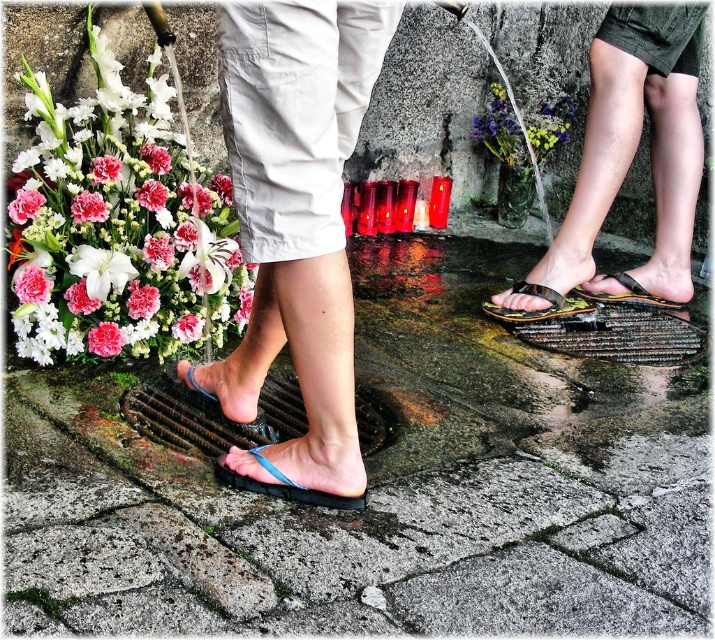
Question: Can you confirm if black rubber sandal at center is smaller than black rubber sandals at lower right?

Choices:
 (A) no
 (B) yes

Answer: (A)

Question: Does black rubber sandals at lower right appear under blue rubber flip-flop at lower left?

Choices:
 (A) yes
 (B) no

Answer: (B)

Question: Among these points, which one is farthest from the camera?

Choices:
 (A) (114, 342)
 (B) (498, 317)
 (C) (61, 433)

Answer: (B)

Question: Does matte floral bouquet at left appear over black rubber sandals at lower right?

Choices:
 (A) no
 (B) yes

Answer: (B)

Question: Which of the following is the farthest from the observer?

Choices:
 (A) (307, 493)
 (B) (423, 529)

Answer: (A)

Question: Among these objects, which one is farthest from the camera?

Choices:
 (A) pink matte carnation at left
 (B) blue rubber flip-flop at lower left
 (C) black rubber sandals at lower right
 (D) black rubber flip-flop at lower left

Answer: (C)